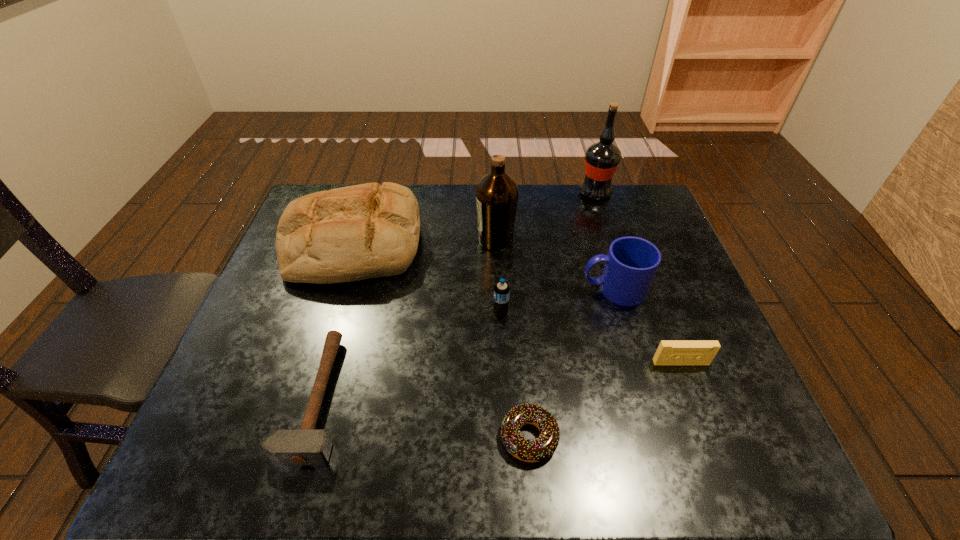
Image resolution: width=960 pixels, height=540 pixels. I want to click on the farthest object, so click(x=601, y=159).

Identify the location of olive oil. The height and width of the screenshot is (540, 960). (497, 193).

Where is `bread`? The height and width of the screenshot is (540, 960). bread is located at coordinates (347, 234).

You are a GUI agent. You are given a task and a screenshot of the screen. Output one action in this format:
    pyautogui.click(x=<x>, y=<y>)
    Task: Click on the mug
    This screenshot has width=960, height=540.
    Given the screenshot: What is the action you would take?
    pyautogui.click(x=631, y=263)

At what (x,y) coordinates should I click in order to perform the action: click on soda bottle. Please return your answer as a coordinate pair (x, y). The image size is (960, 540). Looking at the image, I should click on (501, 291).

This screenshot has width=960, height=540. In order to click on the third shortest object in this screenshot , I will do `click(669, 352)`.

In order to click on hammer in this screenshot , I will do `click(305, 446)`.

Image resolution: width=960 pixels, height=540 pixels. I want to click on the shortest object, so (x=543, y=447).

Find the location of a particular element. This screenshot has height=540, width=960. vacant space located on the right of the farthest object is located at coordinates (632, 193).

In order to click on vacant space located 0.140m on the label of the olive oil in this screenshot , I will do `click(430, 240)`.